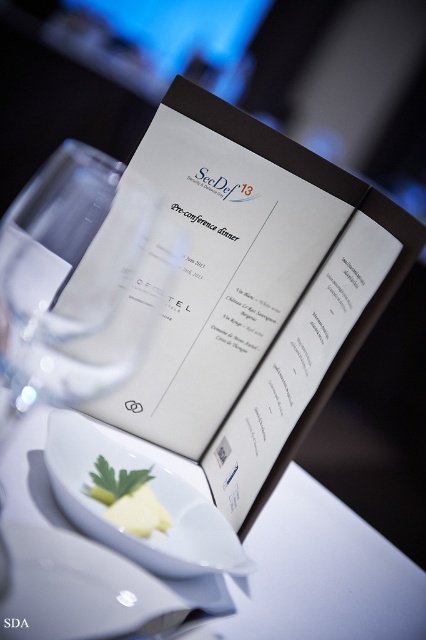
You are a guest at the dinner and want to reach for the yellow butter at center without moving the white glossy bowl at center. Is this possible?

The white glossy bowl at center is in front of the yellow butter at center, so you cannot reach the yellow butter at center without moving the white glossy bowl at center.

You are a server at the dinner and need to place a napkin on the table. The napkin is the same size as the yellow butter at center. Will the napkin fit entirely on the white glossy plate at lower center?

The white glossy plate at lower center is bigger than the yellow butter at center, so yes, the napkin will fit entirely on the white glossy plate at lower center.